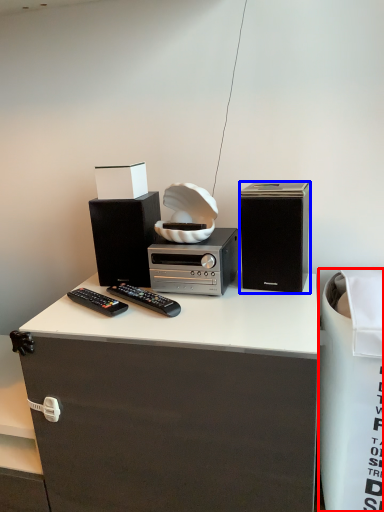
Question: Which of the following is the closest to the observer, trash bin/can (highlighted by a red box) or loudspeaker (highlighted by a blue box)?

Choices:
 (A) trash bin/can
 (B) loudspeaker

Answer: (A)